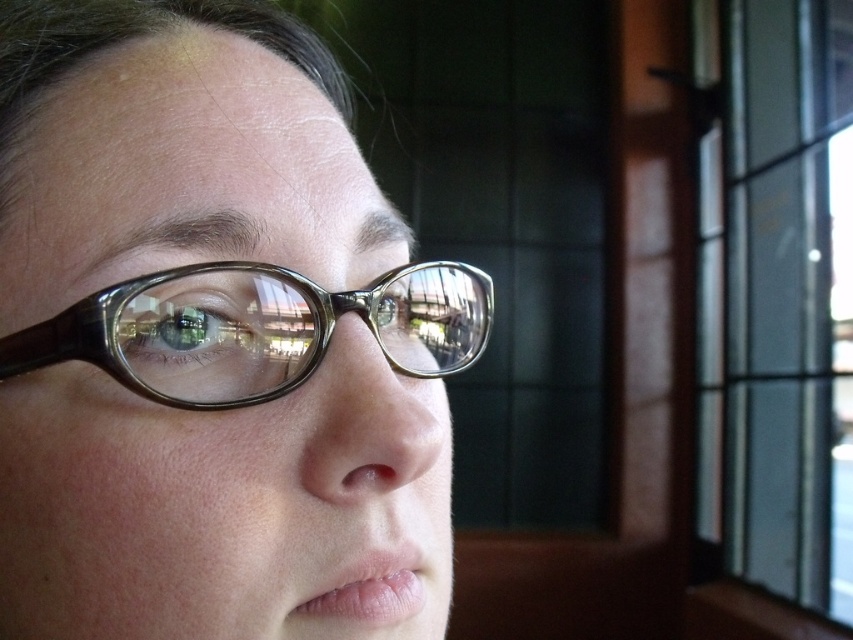
You are an interior designer assessing the lighting in a room. You notice the transparent plastic glasses at center and the transparent glass window at upper right. Which object appears larger in the scene?

The transparent glass window at upper right appears larger than the transparent plastic glasses at center.

You are an interior designer assessing the lighting in a room. You notice the transparent glass window at upper right and the translucent plastic glasses at center. Which object allows more natural light to pass through based on their material and size?

The transparent glass window at upper right allows more natural light to pass through because it is made of transparent glass and is larger in size than the translucent plastic glasses at center, which are made of a material that diffuses light more.

You are trying to determine which pair of glasses is wider between the transparent plastic glasses at center and the translucent plastic glasses at center. Which one is wider?

The transparent plastic glasses at center is wider than the translucent plastic glasses at center according to the description.